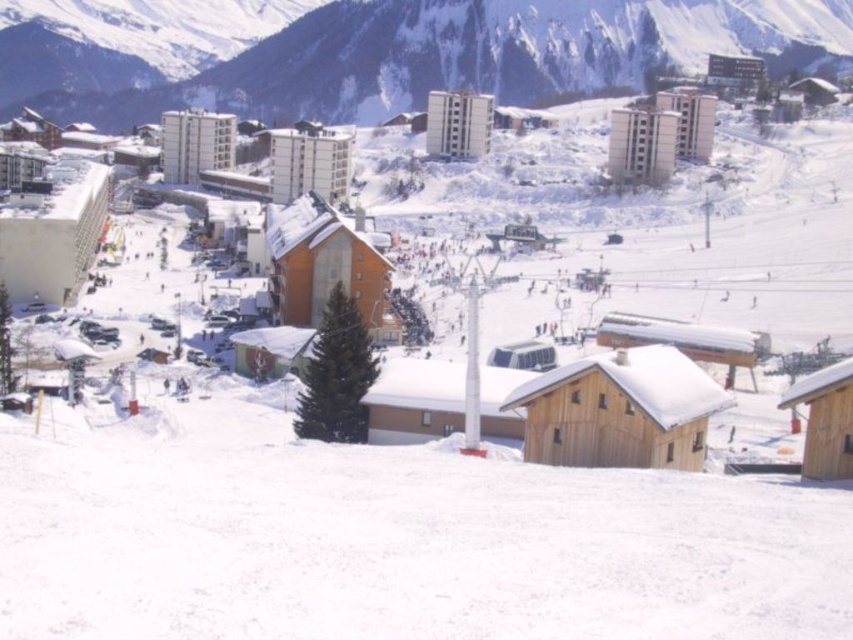
Question: Which point is closer to the camera?

Choices:
 (A) snowy mountain at upper center
 (B) white snow at lower center

Answer: (B)

Question: Among these objects, which one is farthest from the camera?

Choices:
 (A) snowy mountain at upper center
 (B) white snow at lower center

Answer: (A)

Question: Is white snow at lower center bigger than snowy mountain at upper center?

Choices:
 (A) yes
 (B) no

Answer: (B)

Question: Can you confirm if white snow at lower center is positioned below snowy mountain at upper center?

Choices:
 (A) yes
 (B) no

Answer: (A)

Question: Does white snow at lower center have a larger size compared to snowy mountain at upper center?

Choices:
 (A) no
 (B) yes

Answer: (A)

Question: Which object is closer to the camera taking this photo?

Choices:
 (A) snowy mountain at upper center
 (B) white snow at lower center

Answer: (B)